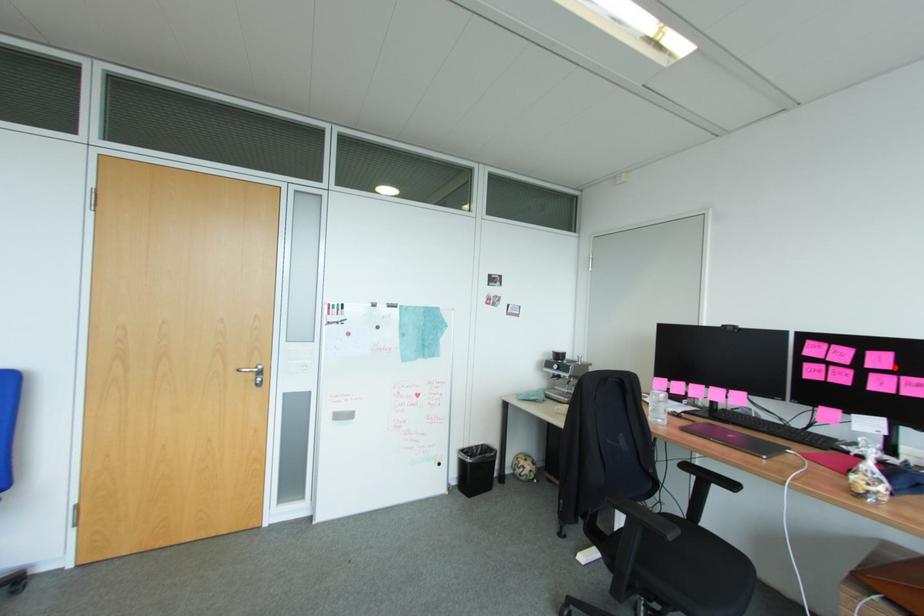
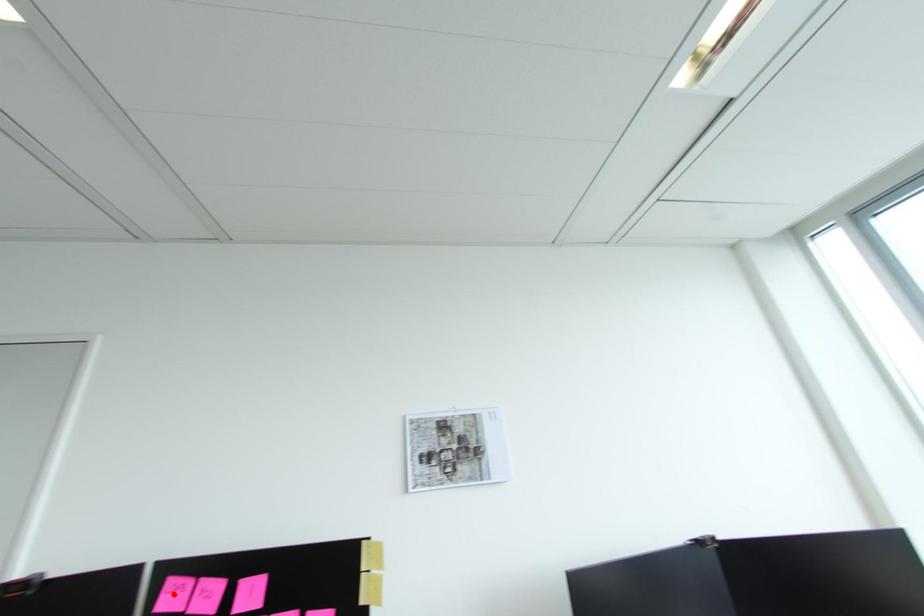
I am providing you with two images of the same scene from different viewpoints. A red point is marked on the first image and another point is marked on the second image. Is the marked point in image1 the same physical position as the marked point in image2?

No